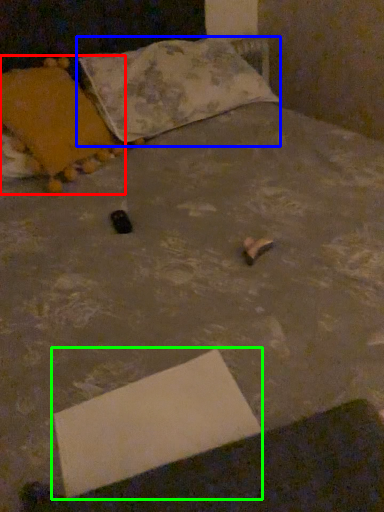
Question: Based on their relative distances, which object is nearer to pillow (highlighted by a red box)? Choose from pillow (highlighted by a blue box) and cardboard box (highlighted by a green box).

Choices:
 (A) pillow
 (B) cardboard box

Answer: (A)